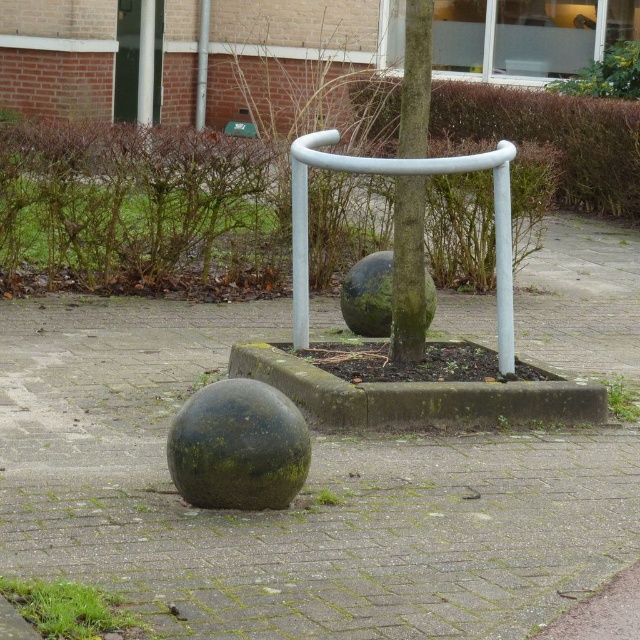
You are a landscape architect designing a pathway around the green mossy sphere at lower left and the white matte rail at center. Based on their sizes, which object requires a wider path to accommodate its dimensions?

The green mossy sphere at lower left requires a wider path because its width surpasses that of the white matte rail at center.

You are a gardener who needs to water the green mossy tree at center. You have a watering can that can spray water up to 36 inches. Is the green mossy concrete at center in the way of watering the tree?

The distance between the green mossy concrete at center and the green mossy tree at center is 36.10 inches. Since the watering can can only spray up to 36 inches, the green mossy concrete at center is slightly closer than the maximum range, so it might block the water from reaching the tree. Adjust your position to ensure the water reaches the tree.